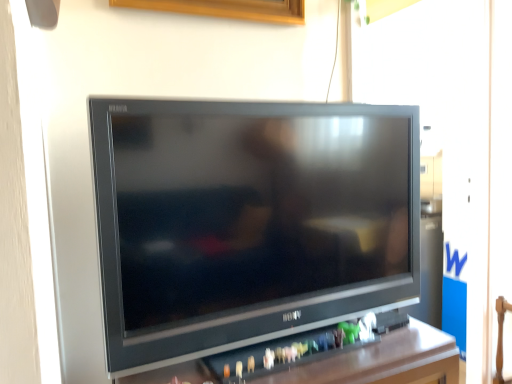
Question: Considering the positions of point (175, 375) and point (394, 201), is point (175, 375) closer or farther from the camera than point (394, 201)?

Choices:
 (A) closer
 (B) farther

Answer: (A)

Question: Considering the positions of black plastic tv at center and satin black television at center in the image, is black plastic tv at center taller or shorter than satin black television at center?

Choices:
 (A) short
 (B) tall

Answer: (A)

Question: Visually, is black plastic tv at center positioned to the left or to the right of satin black television at center?

Choices:
 (A) left
 (B) right

Answer: (A)

Question: Is satin black television at center to the left or to the right of black plastic tv at center in the image?

Choices:
 (A) right
 (B) left

Answer: (A)

Question: Considering the positions of satin black television at center and black plastic tv at center in the image, is satin black television at center bigger or smaller than black plastic tv at center?

Choices:
 (A) small
 (B) big

Answer: (A)

Question: From a real-world perspective, relative to black plastic tv at center, is satin black television at center vertically above or below?

Choices:
 (A) above
 (B) below

Answer: (A)

Question: Is satin black television at center inside the boundaries of black plastic tv at center, or outside?

Choices:
 (A) outside
 (B) inside

Answer: (A)